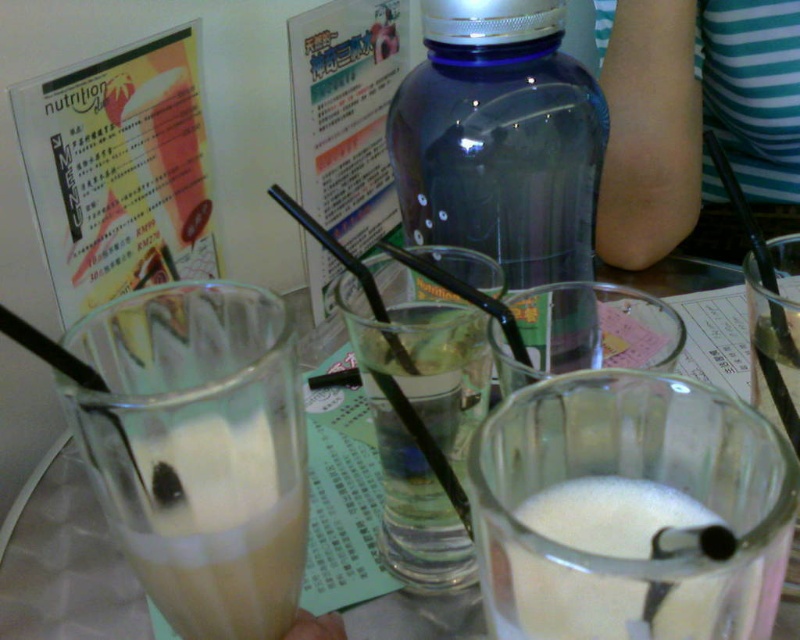
You are a customer at a cafe and want to pour water from the transparent plastic bottle at center into the clear glass cups at center. Based on their positions, which direction should you move the bottle to align it with the cups?

The transparent plastic bottle at center is to the left of clear glass cups at center, so you should move the bottle to the right to align it with the cups.

You are a customer at a cafe and want to order a drink that comes in a larger container. You see the clear glass cups at center and the white frothy milk at lower center on the table. Which one should you choose?

The clear glass cups at center is larger in size than the white frothy milk at lower center, so you should choose the clear glass cups at center.